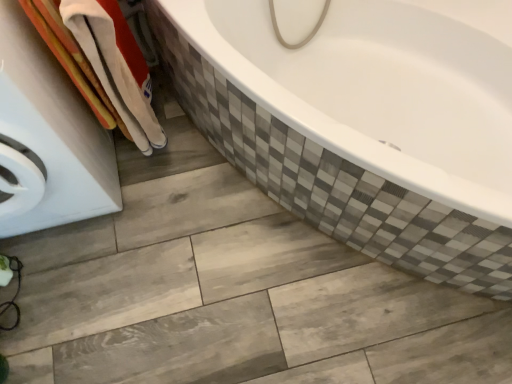
Locate an element on the screen. The width and height of the screenshot is (512, 384). free spot in front of white cotton towel at left is located at coordinates (159, 199).